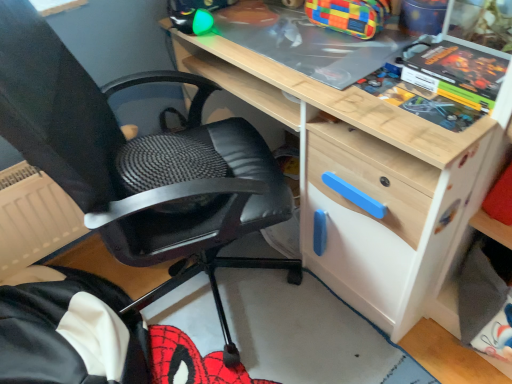
At what (x,y) coordinates should I click in order to perform the action: click on free point above matt black comic book at upper right (from a real-world perspective). Please return your answer as a coordinate pair (x, y). This screenshot has height=384, width=512. Looking at the image, I should click on (462, 67).